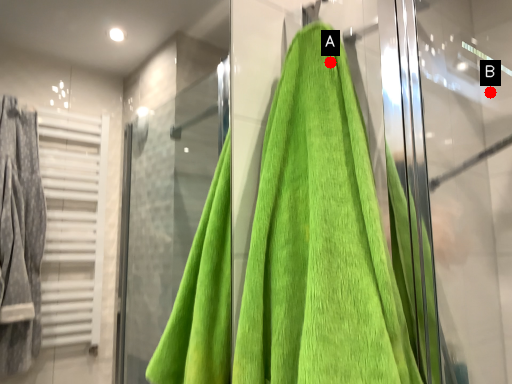
Question: Two points are circled on the image, labeled by A and B beside each circle. Which point appears farthest from the camera in this image?

Choices:
 (A) A is further
 (B) B is further

Answer: (B)